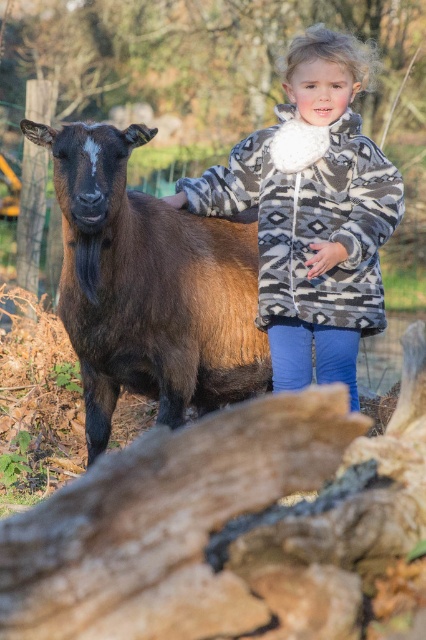
The child and the brown fuzzy goat at left are standing in a field. The child wants to throw a ball to the goat. If the ball travels 3 meters, will it reach the goat?

The child and the brown fuzzy goat at left are 3.52 meters apart. Since the ball only travels 3 meters, it will not reach the goat.

You are a photographer trying to capture a photo of the brown fuzzy goat at left and the patterned fleece jacket at center. Since you want the goat to look bigger in the photo, should you move closer to the goat or the jacket?

To make the brown fuzzy goat at left appear larger in the photo, you should move closer to it because it is shorter than the patterned fleece jacket at center. Moving closer to the goat will magnify its size relative to the jacket in the frame.

You are a photographer standing at the center of the scene. You want to take a photo of the brown fuzzy goat at left. Where should you point your camera to capture it?

You should point your camera towards the left side of the scene to capture the brown fuzzy goat at left, as it is located at point (x=149, y=288).